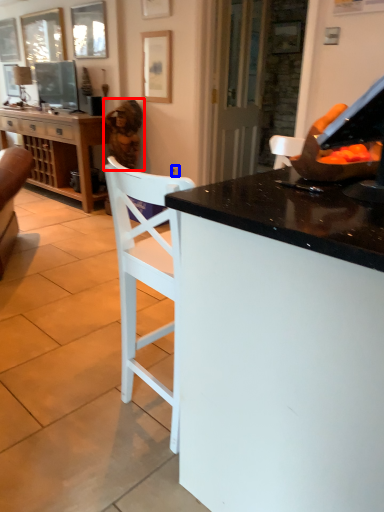
Question: Among these objects, which one is nearest to the camera, woman (highlighted by a red box) or power outlet (highlighted by a blue box)?

Choices:
 (A) woman
 (B) power outlet

Answer: (A)